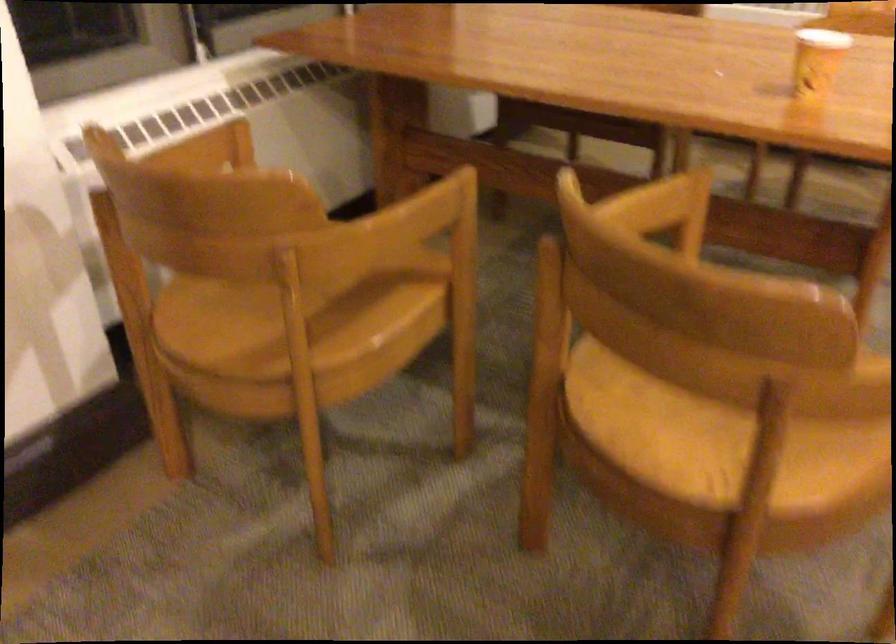
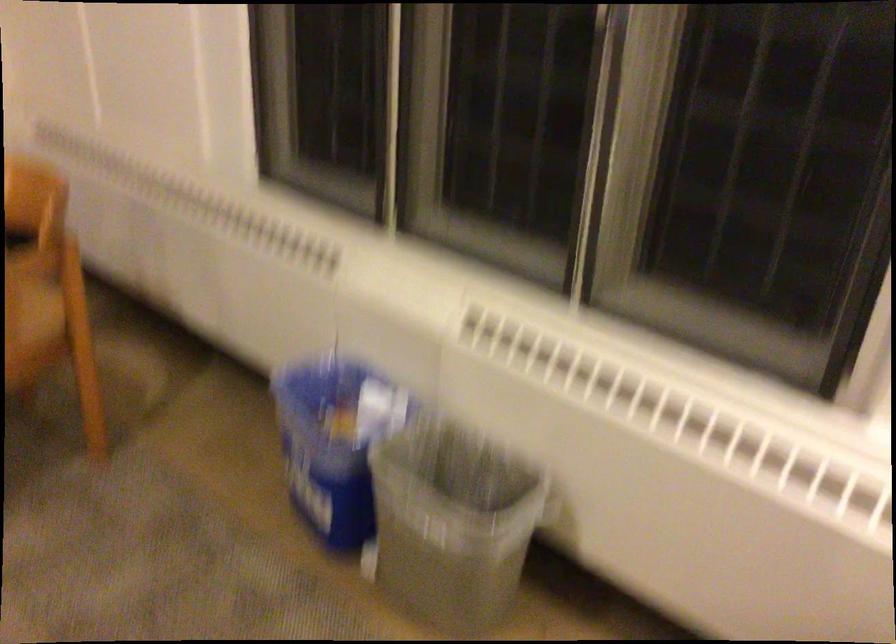
Question: The images are taken continuously from a first-person perspective. In which direction are you moving?

Choices:
 (A) Left
 (B) Right
 (C) Forward
 (D) Backward

Answer: (B)